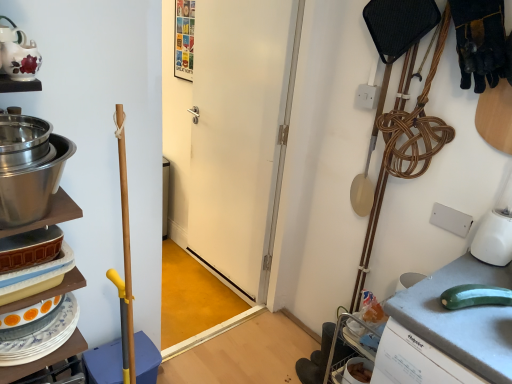
Measure the distance between point [407,312] and camera.

Point [407,312] is 3.75 feet away from camera.

Describe the element at coordinates (21, 60) in the screenshot. I see `matte ceramic teapot at upper left` at that location.

You are a GUI agent. You are given a task and a screenshot of the screen. Output one action in this format:
    pyautogui.click(x=<x>, y=<y>)
    Task: Click on the white matte door at center
    The width and height of the screenshot is (512, 384).
    Given the screenshot: What is the action you would take?
    [x=234, y=136]

Considering the sizes of objects white matte door at center and stainless steel bowl at left in the image provided, who is bigger, white matte door at center or stainless steel bowl at left?

white matte door at center is bigger.

Is white matte door at center outside of stainless steel bowl at left?

That's correct, white matte door at center is outside of stainless steel bowl at left.

The width and height of the screenshot is (512, 384). I want to click on appliance to the left of white matte door at center, so click(29, 168).

From a real-world perspective, relative to stainless steel bowl at left, is white matte door at center vertically above or below?

white matte door at center is below stainless steel bowl at left.

How different are the orientations of green rubber at right and stainless steel bowl at left in degrees?

90.3 degrees.

Considering the positions of point (421, 305) and point (44, 203), is point (421, 305) closer or farther from the camera than point (44, 203)?

Clearly, point (421, 305) is more distant from the camera than point (44, 203).

In the scene shown: Between green rubber at right and stainless steel bowl at left, which one has less height?

stainless steel bowl at left is shorter.

From the image's perspective, who appears lower, green rubber at right or stainless steel bowl at left?

green rubber at right, from the image's perspective.

The height and width of the screenshot is (384, 512). Identify the location of tea pot that appears in front of the green rubber at right. (21, 60).

Is green rubber at right situated inside matte ceramic teapot at upper left or outside?

green rubber at right is located beyond the bounds of matte ceramic teapot at upper left.

Who is bigger, green rubber at right or matte ceramic teapot at upper left?

With larger size is green rubber at right.

Considering the relative sizes of green rubber at right and matte ceramic teapot at upper left in the image provided, is green rubber at right taller than matte ceramic teapot at upper left?

Yes.

From the image's perspective, which one is positioned higher, matte ceramic teapot at upper left or green rubber at right?

From the image's view, matte ceramic teapot at upper left is above.

At what (x,y) coordinates should I click in order to perform the action: click on tea pot located on the left of green rubber at right. Please return your answer as a coordinate pair (x, y). This screenshot has width=512, height=384. Looking at the image, I should click on (21, 60).

Based on their sizes in the image, would you say matte ceramic teapot at upper left is bigger or smaller than green rubber at right?

In the image, matte ceramic teapot at upper left appears to be smaller than green rubber at right.

Is stainless steel bowl at left surrounded by matte ceramic teapot at upper left?

No.

Considering the relative positions of matte ceramic teapot at upper left and stainless steel bowl at left in the image provided, is matte ceramic teapot at upper left to the left or to the right of stainless steel bowl at left?

Clearly, matte ceramic teapot at upper left is on the left of stainless steel bowl at left in the image.

From a real-world perspective, is matte ceramic teapot at upper left above or below stainless steel bowl at left?

matte ceramic teapot at upper left is above stainless steel bowl at left.

Does point (11, 46) come closer to viewer compared to point (41, 155)?

No, (11, 46) is behind (41, 155).

From the image's perspective, between matte ceramic teapot at upper left and white matte door at center, which one is located above?

matte ceramic teapot at upper left.

What's the angular difference between matte ceramic teapot at upper left and white matte door at center's facing directions?

matte ceramic teapot at upper left and white matte door at center are facing 92.6 degrees away from each other.

Considering the sizes of objects matte ceramic teapot at upper left and white matte door at center in the image provided, who is shorter, matte ceramic teapot at upper left or white matte door at center?

With less height is matte ceramic teapot at upper left.

From a real-world perspective, is matte ceramic teapot at upper left located beneath white matte door at center?

No, from a real-world perspective, matte ceramic teapot at upper left is not beneath white matte door at center.

Consider the image. From a real-world perspective, is white matte door at center below green rubber at right?

No, from a real-world perspective, white matte door at center is not below green rubber at right.

Based on their positions, is white matte door at center located to the left or right of green rubber at right?

In the image, white matte door at center appears on the left side of green rubber at right.

Does point (260, 39) lie behind point (459, 375)?

Yes, point (260, 39) is behind point (459, 375).

In the image, there is a white matte door at center. What are the coordinates of `counter top below it (from the image's perspective)` in the screenshot? It's located at (447, 331).

Find the location of a particular element. The height and width of the screenshot is (384, 512). door behind the stainless steel bowl at left is located at coordinates (234, 136).

Identify the location of counter top lying below the stainless steel bowl at left (from the image's perspective). (447, 331).

Looking at the image, which one is located closer to green rubber at right, matte ceramic teapot at upper left or white matte door at center?

The object closer to green rubber at right is matte ceramic teapot at upper left.

From the image, which object appears to be farther from matte ceramic teapot at upper left, stainless steel bowl at left or white matte door at center?

white matte door at center is positioned further to the anchor matte ceramic teapot at upper left.

Based on their spatial positions, is stainless steel bowl at left or green rubber at right further from matte ceramic teapot at upper left?

Based on the image, green rubber at right appears to be further to matte ceramic teapot at upper left.

Based on their spatial positions, is matte ceramic teapot at upper left or white matte door at center closer to stainless steel bowl at left?

matte ceramic teapot at upper left is positioned closer to the anchor stainless steel bowl at left.

Based on their spatial positions, is stainless steel bowl at left or green rubber at right further from white matte door at center?

stainless steel bowl at left is further to white matte door at center.

Looking at the image, which one is located closer to white matte door at center, matte ceramic teapot at upper left or green rubber at right?

green rubber at right is closer to white matte door at center.

From the image, which object appears to be farther from green rubber at right, matte ceramic teapot at upper left or stainless steel bowl at left?

matte ceramic teapot at upper left is positioned further to the anchor green rubber at right.

Which object lies further to the anchor point matte ceramic teapot at upper left, green rubber at right or white matte door at center?

white matte door at center is positioned further to the anchor matte ceramic teapot at upper left.

At what (x,y) coordinates should I click in order to perform the action: click on appliance situated between matte ceramic teapot at upper left and green rubber at right from left to right. Please return your answer as a coordinate pair (x, y). Looking at the image, I should click on (29, 168).

Locate an element on the screen. The width and height of the screenshot is (512, 384). tea pot between stainless steel bowl at left and white matte door at center in the front-back direction is located at coordinates (21, 60).

Identify the location of door situated between matte ceramic teapot at upper left and green rubber at right from left to right. (234, 136).

Where is `door between stainless steel bowl at left and green rubber at right in the horizontal direction`? This screenshot has height=384, width=512. door between stainless steel bowl at left and green rubber at right in the horizontal direction is located at coordinates (234, 136).